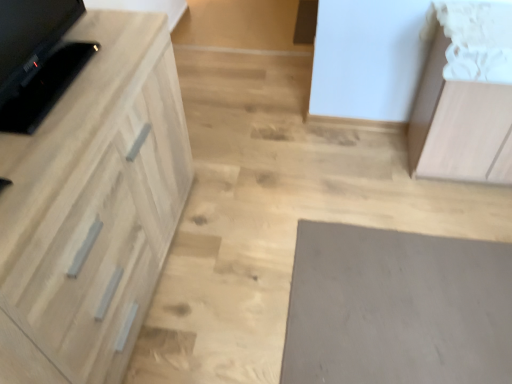
Question: Should I look upward or downward to see gray matte mat at lower right?

Choices:
 (A) down
 (B) up

Answer: (A)

Question: From the image's perspective, is light brown wood cabinet at upper right, the 1th cabinetry when ordered from right to left, beneath black glossy tv at left?

Choices:
 (A) yes
 (B) no

Answer: (A)

Question: From a real-world perspective, is light brown wood cabinet at upper right, the 2th cabinetry viewed from the left, physically below black glossy tv at left?

Choices:
 (A) no
 (B) yes

Answer: (B)

Question: From the image's perspective, is light brown wood cabinet at upper right, the 2th cabinetry viewed from the left, on black glossy tv at left?

Choices:
 (A) yes
 (B) no

Answer: (B)

Question: Does light brown wood cabinet at upper right, the 1th cabinetry when ordered from right to left, have a greater width compared to black glossy tv at left?

Choices:
 (A) yes
 (B) no

Answer: (A)

Question: Can you confirm if light brown wood cabinet at upper right, the 2th cabinetry viewed from the left, is smaller than black glossy tv at left?

Choices:
 (A) yes
 (B) no

Answer: (B)

Question: Does light brown wood cabinet at upper right, the 2th cabinetry viewed from the left, appear on the right side of black glossy tv at left?

Choices:
 (A) yes
 (B) no

Answer: (A)

Question: Can we say black glossy tv at left lies outside light wood cabinet at left, the 1th cabinetry when ordered from left to right?

Choices:
 (A) yes
 (B) no

Answer: (A)

Question: Is black glossy tv at left at the left side of light wood cabinet at left, acting as the 2th cabinetry starting from the right?

Choices:
 (A) no
 (B) yes

Answer: (B)

Question: Is light wood cabinet at left, the 1th cabinetry when ordered from left to right, at the back of black glossy tv at left?

Choices:
 (A) yes
 (B) no

Answer: (B)

Question: Is black glossy tv at left shorter than light wood cabinet at left, acting as the 2th cabinetry starting from the right?

Choices:
 (A) no
 (B) yes

Answer: (B)

Question: Does black glossy tv at left have a smaller size compared to light wood cabinet at left, acting as the 2th cabinetry starting from the right?

Choices:
 (A) yes
 (B) no

Answer: (A)

Question: Does black glossy tv at left come behind light wood cabinet at left, acting as the 2th cabinetry starting from the right?

Choices:
 (A) yes
 (B) no

Answer: (A)

Question: Is the depth of light brown wood cabinet at upper right, the 2th cabinetry viewed from the left, less than that of light wood cabinet at left, the 1th cabinetry when ordered from left to right?

Choices:
 (A) yes
 (B) no

Answer: (B)